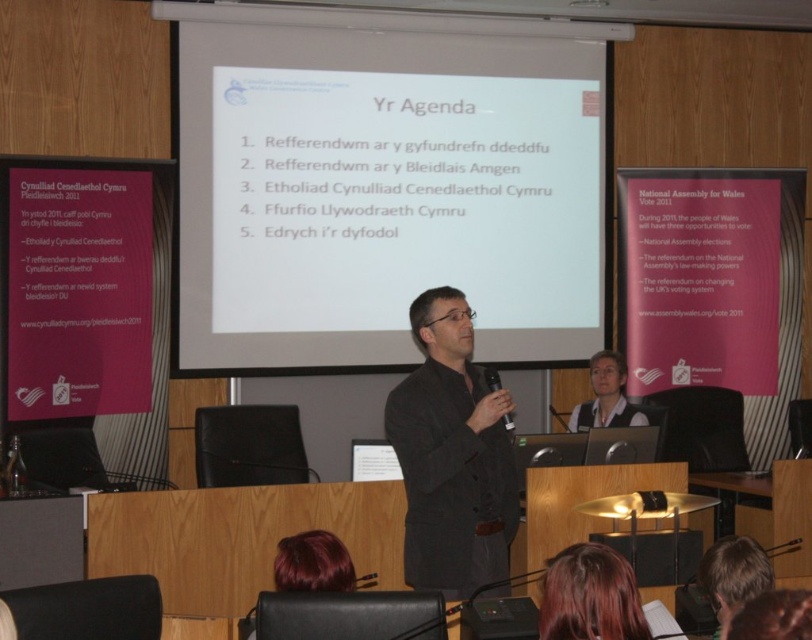
Can you confirm if white matte projection screen at center is positioned below black plastic microphone at center?

Incorrect, white matte projection screen at center is not positioned below black plastic microphone at center.

Who is lower down, white matte projection screen at center or black plastic microphone at center?

Positioned lower is black plastic microphone at center.

Is point (221, 51) closer to camera compared to point (506, 420)?

No, it is not.

Where is `white matte projection screen at center`? This screenshot has width=812, height=640. white matte projection screen at center is located at coordinates (383, 189).

Can you confirm if white matte projection screen at center is positioned to the right of smooth brown hair at lower right?

In fact, white matte projection screen at center is to the left of smooth brown hair at lower right.

Does white matte projection screen at center appear over smooth brown hair at lower right?

Indeed, white matte projection screen at center is positioned over smooth brown hair at lower right.

Which is in front, point (558, 138) or point (771, 612)?

Point (771, 612) is in front.

You are a GUI agent. You are given a task and a screenshot of the screen. Output one action in this format:
    pyautogui.click(x=<x>, y=<y>)
    Task: Click on the white matte projection screen at center
    The width and height of the screenshot is (812, 640).
    Given the screenshot: What is the action you would take?
    pyautogui.click(x=383, y=189)

The image size is (812, 640). I want to click on smooth hair at lower center, so click(x=590, y=596).

Identify the location of smooth hair at lower center. The height and width of the screenshot is (640, 812). (590, 596).